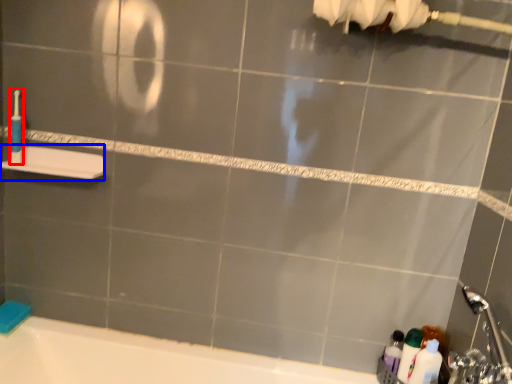
Question: Which object is further to the camera taking this photo, toothbrush (highlighted by a red box) or towel bar (highlighted by a blue box)?

Choices:
 (A) toothbrush
 (B) towel bar

Answer: (A)